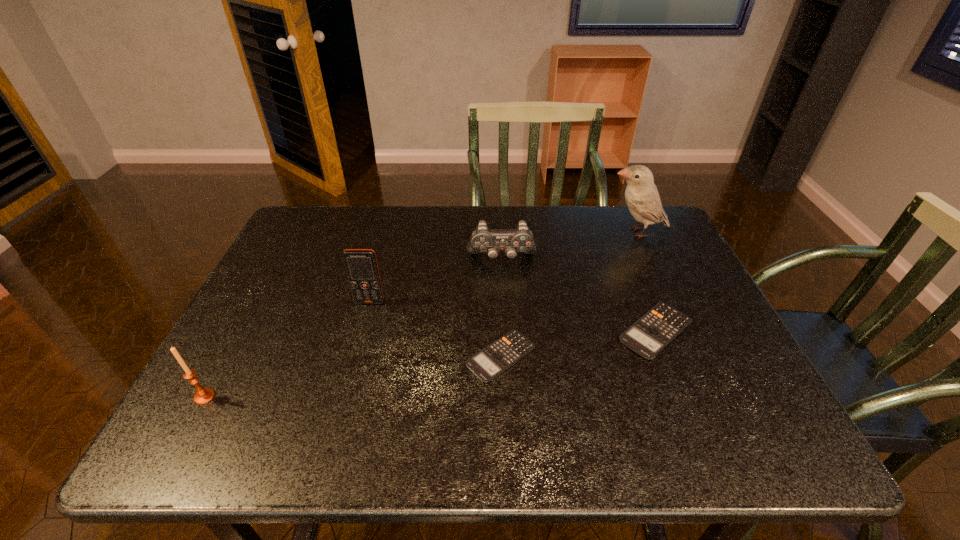
This screenshot has height=540, width=960. In order to click on vacant space at the far right corner of the desktop in this screenshot , I will do `click(636, 221)`.

Locate an element on the screen. The height and width of the screenshot is (540, 960). free point at the near right corner is located at coordinates tap(691, 406).

Find the location of a particular element. The height and width of the screenshot is (540, 960). free spot between the control and the fifth object from right to left is located at coordinates (436, 281).

Where is `empty space that is in between the second shortest object and the tallest object`? empty space that is in between the second shortest object and the tallest object is located at coordinates (646, 281).

Identify the location of free point between the nearest object and the second farthest object. The width and height of the screenshot is (960, 540). (353, 328).

At what (x,y) coordinates should I click in order to perform the action: click on free area in between the second shortest object and the fifth object from right to left. Please return your answer as a coordinate pair (x, y). The height and width of the screenshot is (540, 960). Looking at the image, I should click on (513, 316).

Find the location of a particular element. This screenshot has height=540, width=960. blank region between the bird and the second object from left to right is located at coordinates (503, 267).

Where is `free space between the cellular telephone and the taller calculator`? The image size is (960, 540). free space between the cellular telephone and the taller calculator is located at coordinates (513, 316).

Where is `free spot between the right calculator and the second farthest object`? The image size is (960, 540). free spot between the right calculator and the second farthest object is located at coordinates (579, 295).

Locate an element on the screen. The image size is (960, 540). vacant space that is in between the taller calculator and the left calculator is located at coordinates (579, 343).